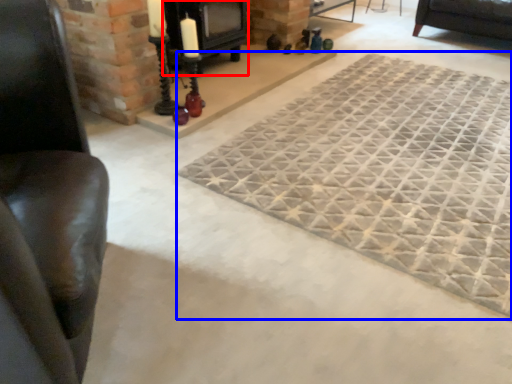
Question: Which object is closer to the camera taking this photo, fireplace (highlighted by a red box) or mat (highlighted by a blue box)?

Choices:
 (A) fireplace
 (B) mat

Answer: (B)